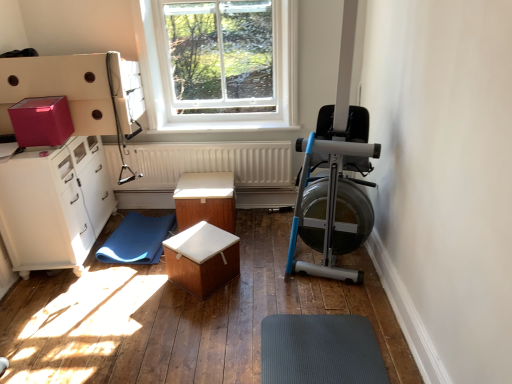
Find the location of a particular element. The image size is (512, 384). free location in front of wooden box at center, the first table in the front-to-back sequence is located at coordinates tap(197, 317).